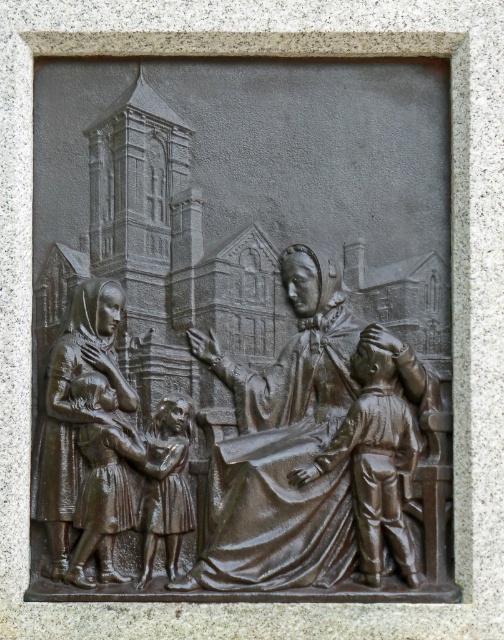
Does bronze statue at center appear on the right side of matte bronze statue at left?

Correct, you'll find bronze statue at center to the right of matte bronze statue at left.

This screenshot has height=640, width=504. What do you see at coordinates (293, 442) in the screenshot? I see `bronze statue at center` at bounding box center [293, 442].

Is point (409, 573) closer to viewer compared to point (71, 493)?

Yes, it is.

The height and width of the screenshot is (640, 504). I want to click on bronze statue at center, so click(293, 442).

Which of these two, bronze statue of woman at center or matte bronze girl at center, stands shorter?

matte bronze girl at center

Is point (357, 474) positioned behind point (147, 483)?

That is False.

Where is `bronze statue of woman at center`? bronze statue of woman at center is located at coordinates (381, 449).

Which of these two, bronze statue at center or matte bronze girl at center, stands taller?

With more height is bronze statue at center.

Which is above, bronze statue at center or matte bronze girl at center?

bronze statue at center is higher up.

Describe the element at coordinates (293, 442) in the screenshot. This screenshot has width=504, height=640. I see `bronze statue at center` at that location.

I want to click on bronze statue at center, so click(x=293, y=442).